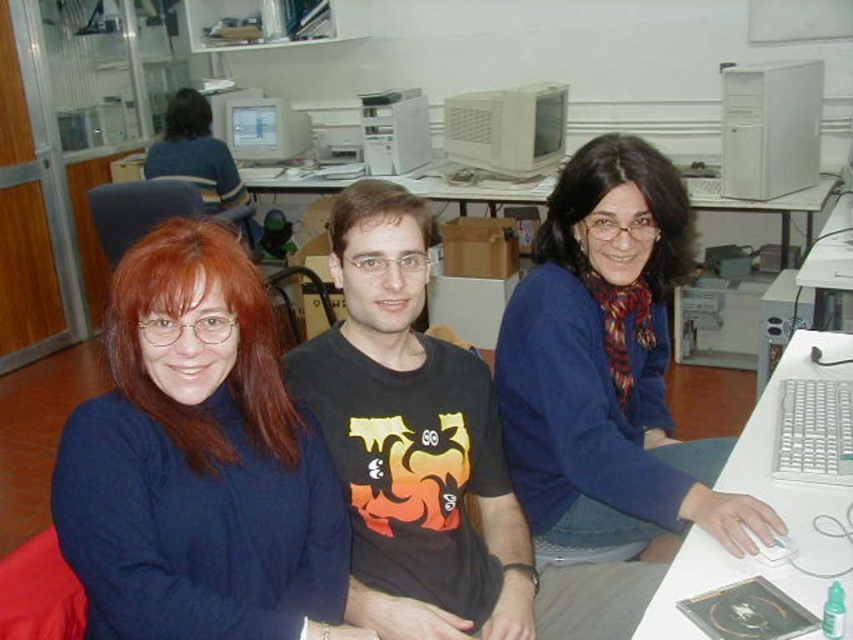
Question: Which point appears farthest from the camera in this image?

Choices:
 (A) 234,108
 (B) 201,141
 (C) 193,440

Answer: (A)

Question: From the image, what is the correct spatial relationship of blue sweater at center in relation to matte gray monitor at center?

Choices:
 (A) left
 (B) right

Answer: (B)

Question: Is blue sweater at left wider than matte gray monitor at center?

Choices:
 (A) yes
 (B) no

Answer: (B)

Question: Which object appears closest to the camera in this image?

Choices:
 (A) blue sweater at center
 (B) white plastic computer tower at upper right
 (C) white plastic monitor at center
 (D) black cotton t-shirt at center

Answer: (A)

Question: Which is farther from the white plastic monitor at center?

Choices:
 (A) matte gray monitor at center
 (B) blue sweater at left
 (C) blue sweater at center

Answer: (B)

Question: Is blue sweater at left to the left of white plastic table at lower right from the viewer's perspective?

Choices:
 (A) yes
 (B) no

Answer: (A)